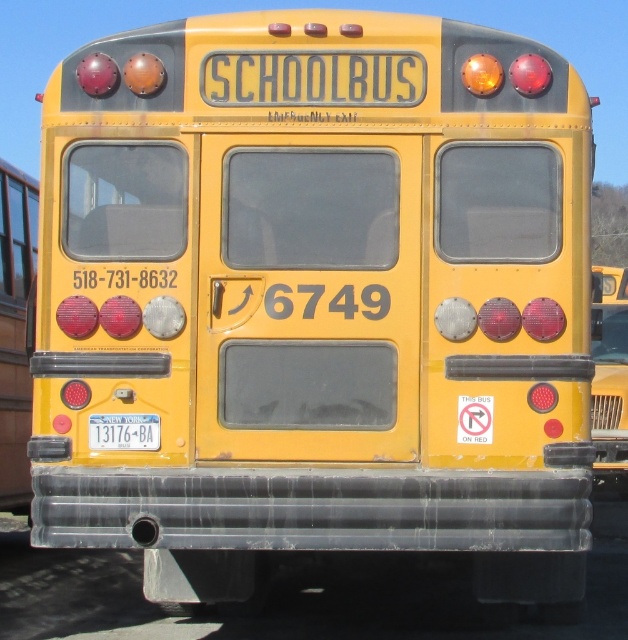
Question: Which point is farther from the camera taking this photo?

Choices:
 (A) (143, 435)
 (B) (625, 504)

Answer: (B)

Question: Is transparent plastic pipe at lower center further to the viewer compared to white plastic license plate at center?

Choices:
 (A) no
 (B) yes

Answer: (B)

Question: Which point appears farthest from the camera in this image?

Choices:
 (A) (95, 428)
 (B) (625, 332)

Answer: (B)

Question: Is yellow matte bus at right above white plastic license plate at center?

Choices:
 (A) no
 (B) yes

Answer: (A)

Question: Can you confirm if transparent plastic pipe at lower center is positioned above white plastic license plate at center?

Choices:
 (A) no
 (B) yes

Answer: (A)

Question: Which object is positioned closest to the yellow matte bus at right?

Choices:
 (A) white plastic license plate at center
 (B) transparent plastic pipe at lower center

Answer: (A)